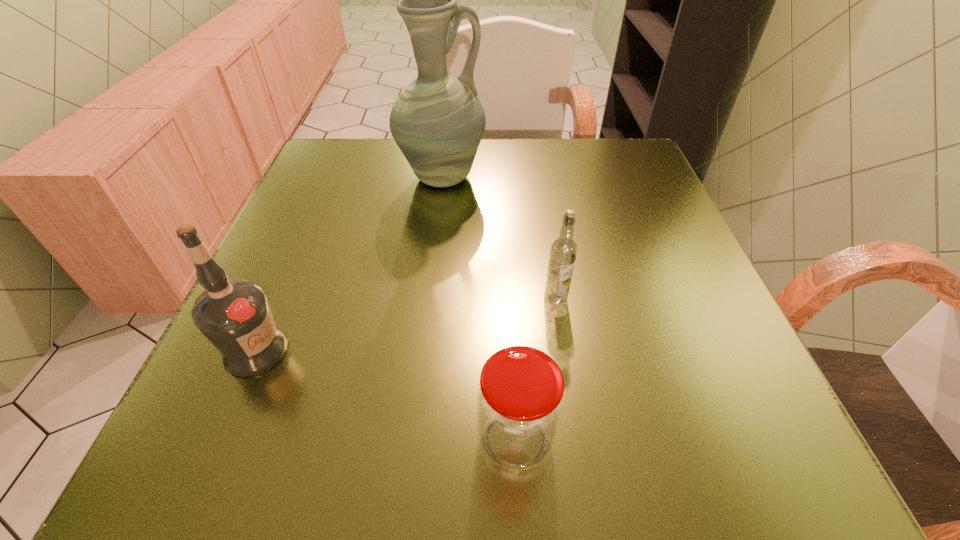
At what (x,y) coordinates should I click in order to perform the action: click on object identified as the closest to the farther vodka. Please return your answer as a coordinate pair (x, y). Looking at the image, I should click on (520, 397).

This screenshot has height=540, width=960. In order to click on vacant space that satisfies the following two spatial constraints: 1. on the back side of the shortest object; 2. on the front label of the left vodka in this screenshot , I will do `click(510, 350)`.

This screenshot has height=540, width=960. I want to click on free space that satisfies the following two spatial constraints: 1. on the handle side of the farthest object; 2. on the back side of the shortest object, so click(413, 439).

You are a GUI agent. You are given a task and a screenshot of the screen. Output one action in this format:
    pyautogui.click(x=<x>, y=<y>)
    Task: Click on the free space that satisfies the following two spatial constraints: 1. on the front label of the nearer vodka; 2. on the right side of the jar
    
    Given the screenshot: What is the action you would take?
    (x=217, y=439)

The width and height of the screenshot is (960, 540). I want to click on vacant position in the image that satisfies the following two spatial constraints: 1. on the front label of the taller vodka; 2. on the left side of the nearest object, so click(x=217, y=439).

Find the location of a particular element. free space that satisfies the following two spatial constraints: 1. on the back side of the jar; 2. on the front label of the nearer vodka is located at coordinates (510, 350).

Identify the location of vacant point that satisfies the following two spatial constraints: 1. on the back side of the jar; 2. on the handle side of the pitcher. (500, 178).

Image resolution: width=960 pixels, height=540 pixels. What are the coordinates of `vacant space that satisfies the following two spatial constraints: 1. on the front label of the nearer vodka; 2. on the left side of the jar` in the screenshot? It's located at (217, 439).

Locate an element on the screen. Image resolution: width=960 pixels, height=540 pixels. free space that satisfies the following two spatial constraints: 1. on the handle side of the farthest object; 2. on the back side of the nearest object is located at coordinates (413, 439).